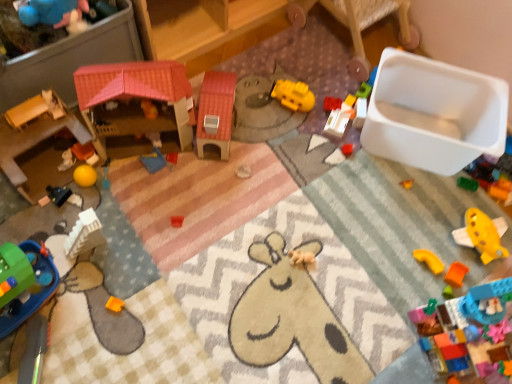
Where is `vacant space in front of smooth wooden dollhouse at left, the 1th toy in the left-to-right sequence`? The height and width of the screenshot is (384, 512). vacant space in front of smooth wooden dollhouse at left, the 1th toy in the left-to-right sequence is located at coordinates (41, 220).